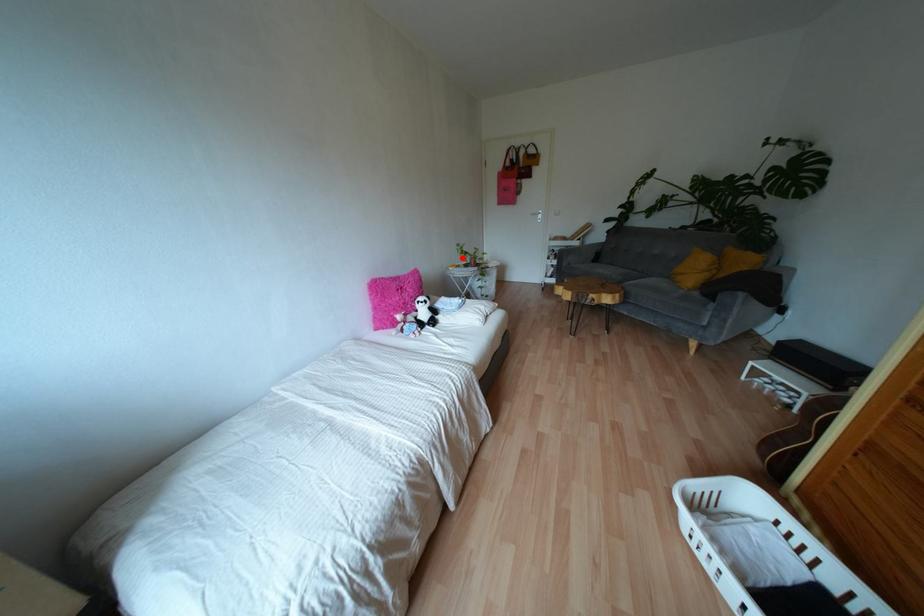
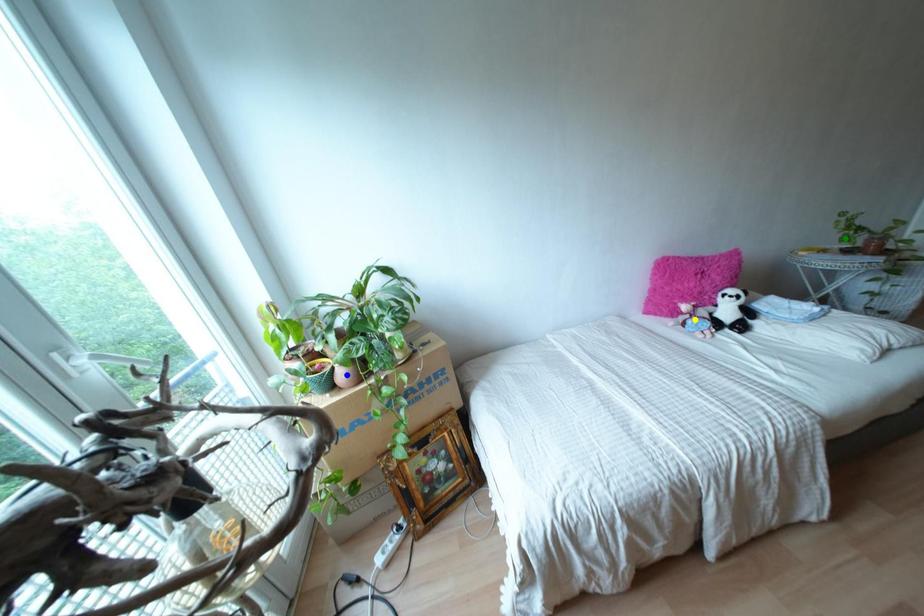
Question: I am providing you with two images of the same scene from different viewpoints. A red point is marked on the first image. You are given multiple points on the second image. Can you choose the point in image 2 that corresponds to the point in image 1?

Choices:
 (A) yellow point
 (B) blue point
 (C) green point

Answer: (C)